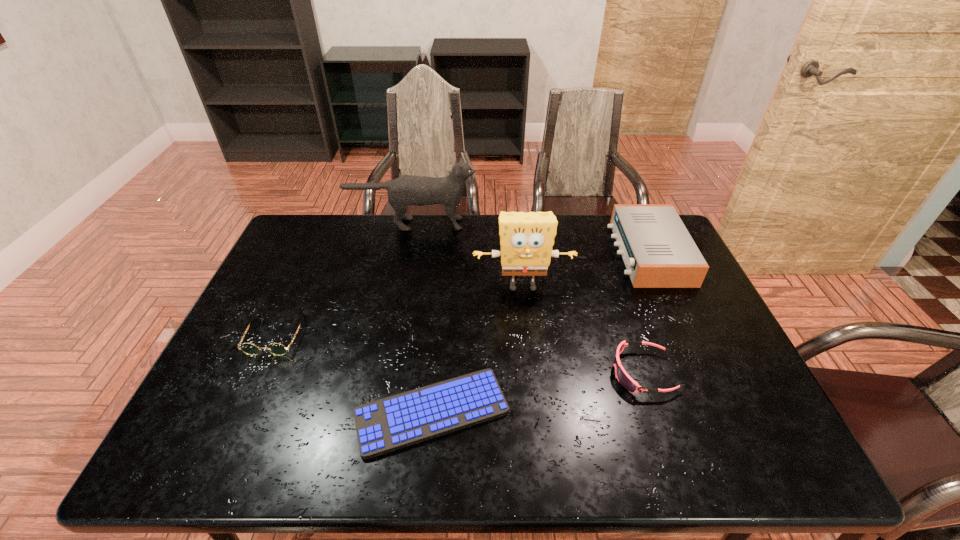
Find the location of a particular element. This screenshot has width=960, height=540. cat is located at coordinates (406, 190).

What are the coordinates of `sponge` in the screenshot? It's located at (526, 239).

You are a GUI agent. You are given a task and a screenshot of the screen. Output one action in this format:
    pyautogui.click(x=<x>, y=<y>)
    Task: Click on the radio receiver
    This screenshot has height=540, width=960.
    Given the screenshot: What is the action you would take?
    pyautogui.click(x=658, y=251)

Identify the location of goggles. (626, 381).

Where is `the leftmost object`? The image size is (960, 540). the leftmost object is located at coordinates (278, 349).

What are the coordinates of `computer keyboard` in the screenshot? It's located at (398, 421).

What are the coordinates of `vacant space situated on the front-facing side of the cat` in the screenshot? It's located at (492, 224).

In order to click on vacant area located on the face of the sponge in this screenshot , I will do `click(536, 415)`.

The width and height of the screenshot is (960, 540). I want to click on blank area located on the control panel of the radio receiver, so click(530, 253).

This screenshot has height=540, width=960. I want to click on free space located 0.170m on the control panel of the radio receiver, so (x=564, y=253).